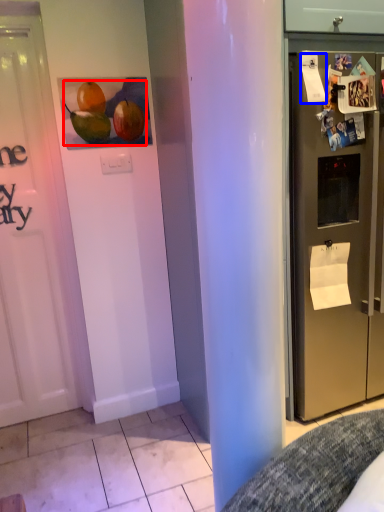
Question: Which point is closer to the camera, fruit (highlighted by a red box) or paper (highlighted by a blue box)?

Choices:
 (A) fruit
 (B) paper

Answer: (B)